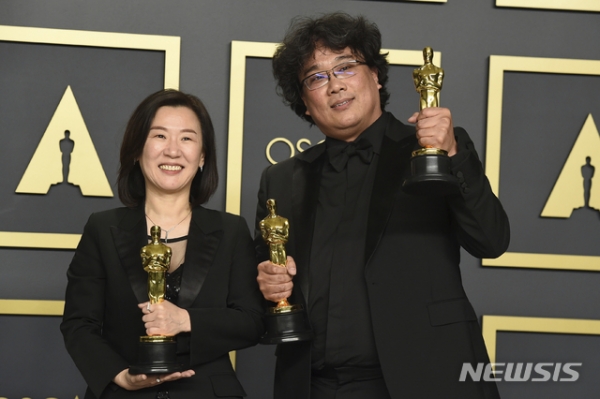
Locate an element on the screen. award is located at coordinates (435, 92), (273, 235), (163, 260).